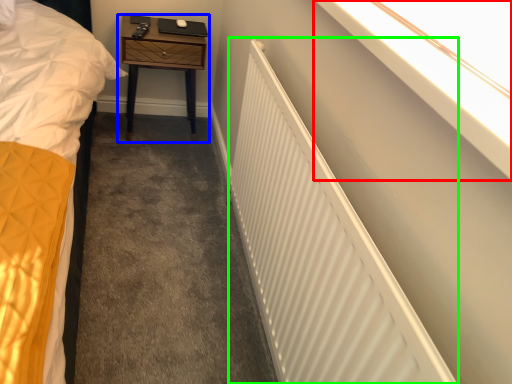
Question: Considering the real-world distances, which object is farthest from window sill (highlighted by a red box)? nightstand (highlighted by a blue box) or radiator (highlighted by a green box)?

Choices:
 (A) nightstand
 (B) radiator

Answer: (A)